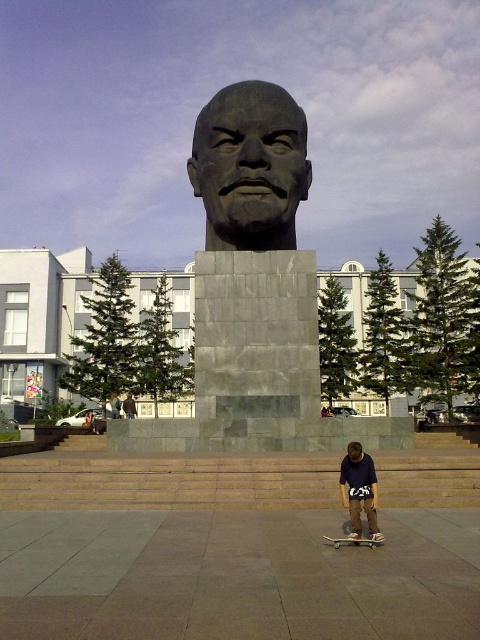
Question: Which point appears farthest from the camera in this image?

Choices:
 (A) (371, 515)
 (B) (359, 460)

Answer: (B)

Question: In this image, where is bronze statue at center located relative to wooden skateboard at lower center?

Choices:
 (A) above
 (B) below

Answer: (A)

Question: Does dark blue cotton shirt at lower center appear over matte gray statue at center?

Choices:
 (A) no
 (B) yes

Answer: (B)

Question: Is bronze statue at center above dark blue cotton shirt at lower center?

Choices:
 (A) yes
 (B) no

Answer: (A)

Question: Based on their relative distances, which object is farther from the wooden skateboard at lower center?

Choices:
 (A) matte gray statue at center
 (B) matte bronze head at center
 (C) bronze statue at center
 (D) dark blue cotton shirt at lower center

Answer: (A)

Question: Which object is farther from the camera taking this photo?

Choices:
 (A) dark blue cotton shirt at lower center
 (B) bronze statue at center

Answer: (B)